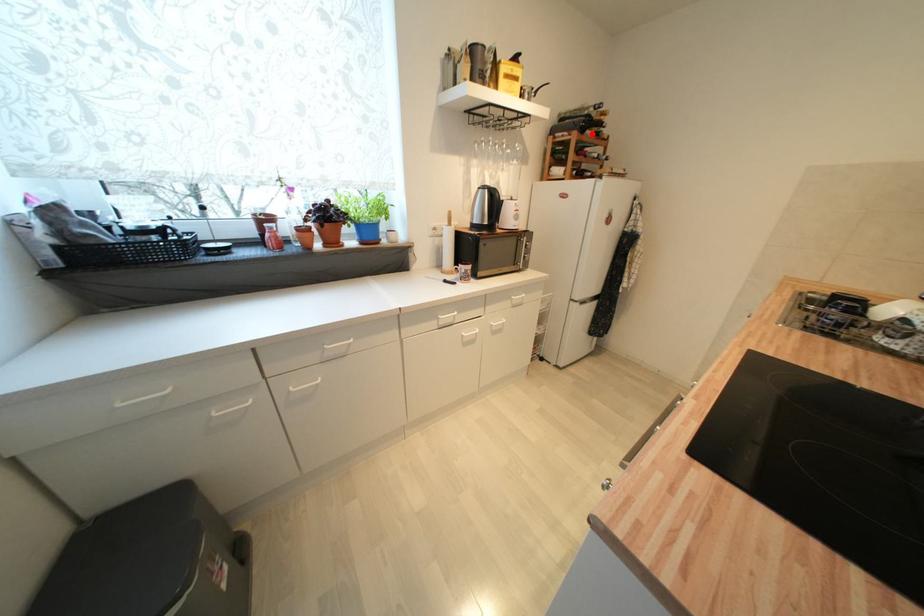
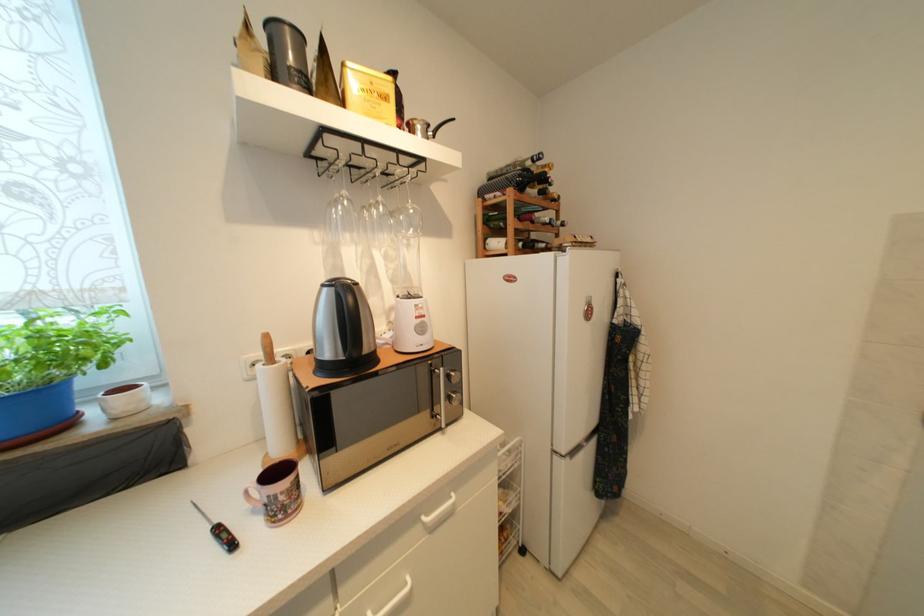
Question: I am providing you with two images of the same scene from different viewpoints. A red point is marked on the first image. Can you still see the location of the red point in image 2?

Choices:
 (A) Yes
 (B) No

Answer: (A)